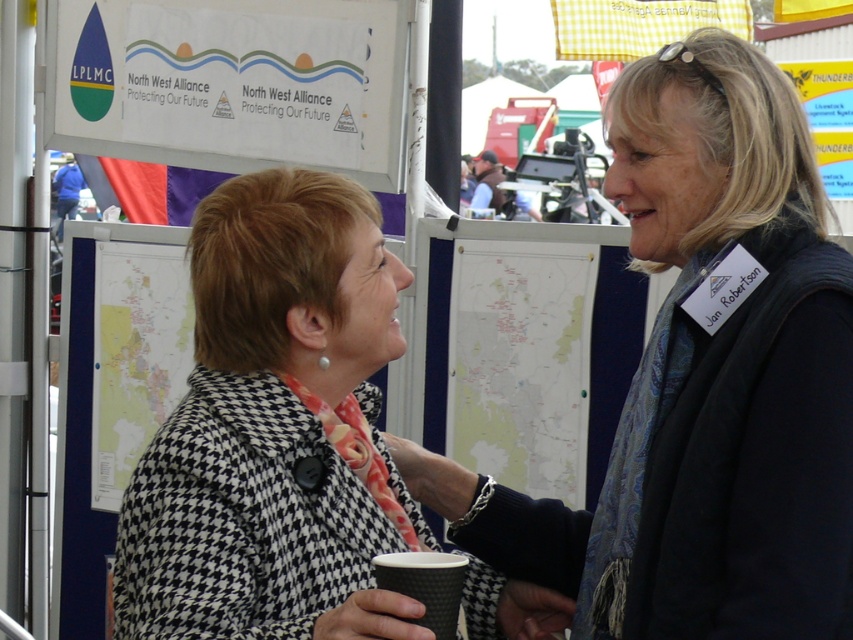
Question: Which of the following is the closest to the observer?

Choices:
 (A) (691, 396)
 (B) (372, 371)

Answer: (A)

Question: Which object is positioned closest to the black paper cup at center?

Choices:
 (A) houndstooth coat at center
 (B) black houndstooth coat at center

Answer: (A)

Question: Does houndstooth coat at center come in front of black paper cup at center?

Choices:
 (A) no
 (B) yes

Answer: (B)

Question: Which of the following is the farthest from the observer?

Choices:
 (A) (409, 580)
 (B) (686, 451)
 (C) (397, 275)

Answer: (C)

Question: Does black houndstooth coat at center appear on the left side of black paper cup at center?

Choices:
 (A) no
 (B) yes

Answer: (A)

Question: Does black houndstooth coat at center appear under black paper cup at center?

Choices:
 (A) yes
 (B) no

Answer: (B)